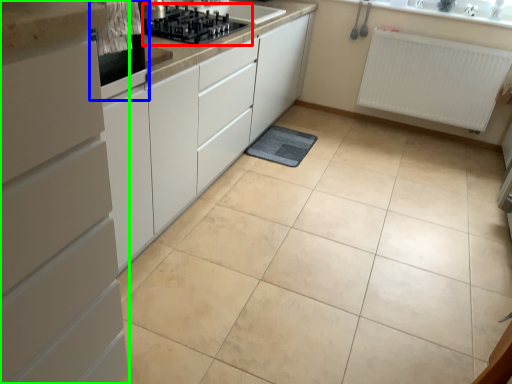
Question: Which object is the farthest from gas stove (highlighted by a red box)? Choose among these: home appliance (highlighted by a blue box) or cabinetry (highlighted by a green box).

Choices:
 (A) home appliance
 (B) cabinetry

Answer: (B)